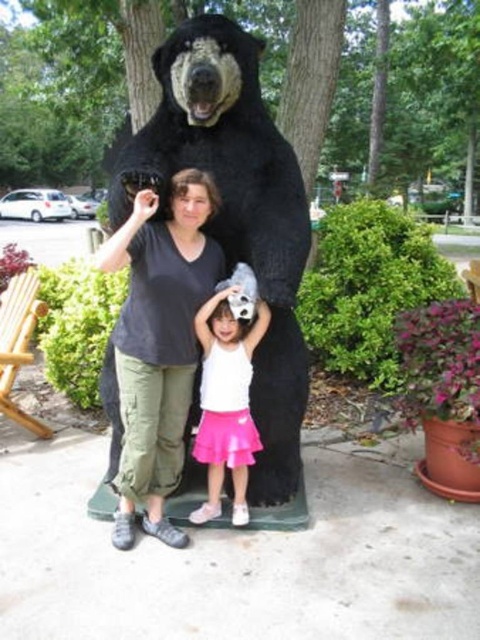
Question: Is black furry bear at center thinner than pink satin skirt at lower center?

Choices:
 (A) no
 (B) yes

Answer: (A)

Question: Which object is closer to the camera taking this photo?

Choices:
 (A) pink satin skirt at lower center
 (B) dark gray t-shirt at center
 (C) black furry bear at center

Answer: (B)

Question: Which point is farther to the camera?

Choices:
 (A) pink satin skirt at lower center
 (B) black furry bear at center
 (C) dark gray t-shirt at center

Answer: (A)

Question: Which point is farther to the camera?

Choices:
 (A) dark gray t-shirt at center
 (B) black furry bear at center
 (C) pink satin skirt at lower center

Answer: (C)

Question: Where is dark gray t-shirt at center located in relation to pink satin skirt at lower center in the image?

Choices:
 (A) right
 (B) left

Answer: (B)

Question: From the image, what is the correct spatial relationship of dark gray t-shirt at center in relation to pink satin skirt at lower center?

Choices:
 (A) right
 (B) left

Answer: (B)